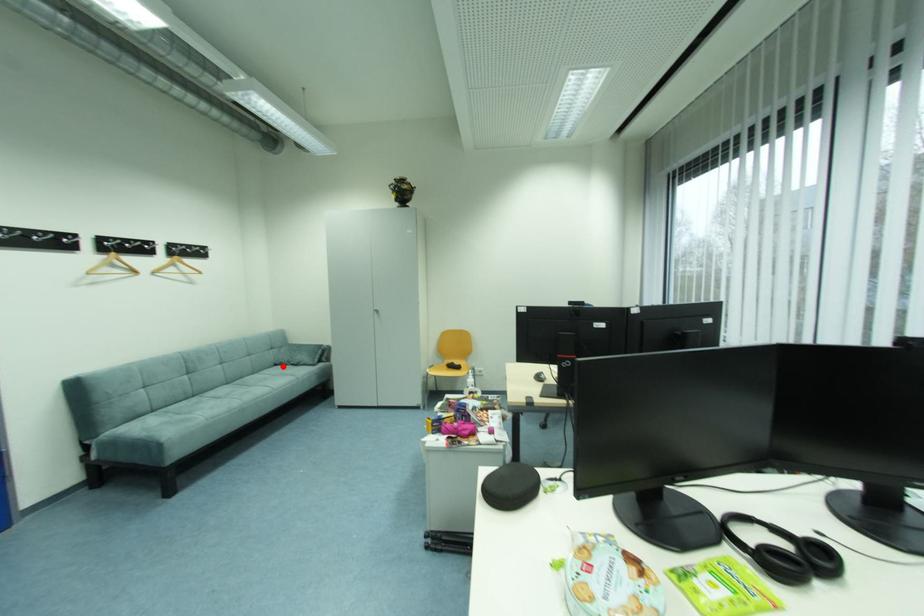
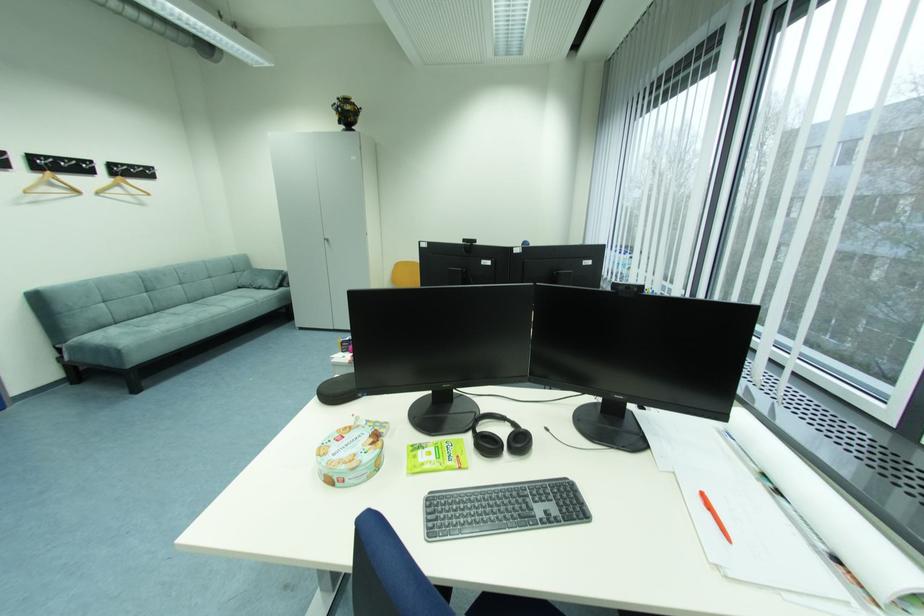
Question: A red point is marked in image1. In image2, is the corresponding 3D point closer to the camera or farther? Reply with the corresponding letter.

Choices:
 (A) The corresponding 3D point is closer.
 (B) The corresponding 3D point is farther.

Answer: (A)